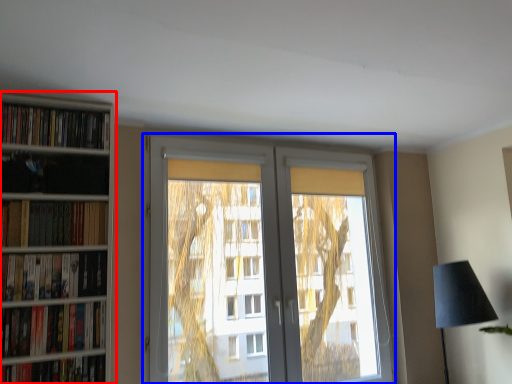
Question: Which object is closer to the camera taking this photo, bookcase (highlighted by a red box) or window (highlighted by a blue box)?

Choices:
 (A) bookcase
 (B) window

Answer: (A)